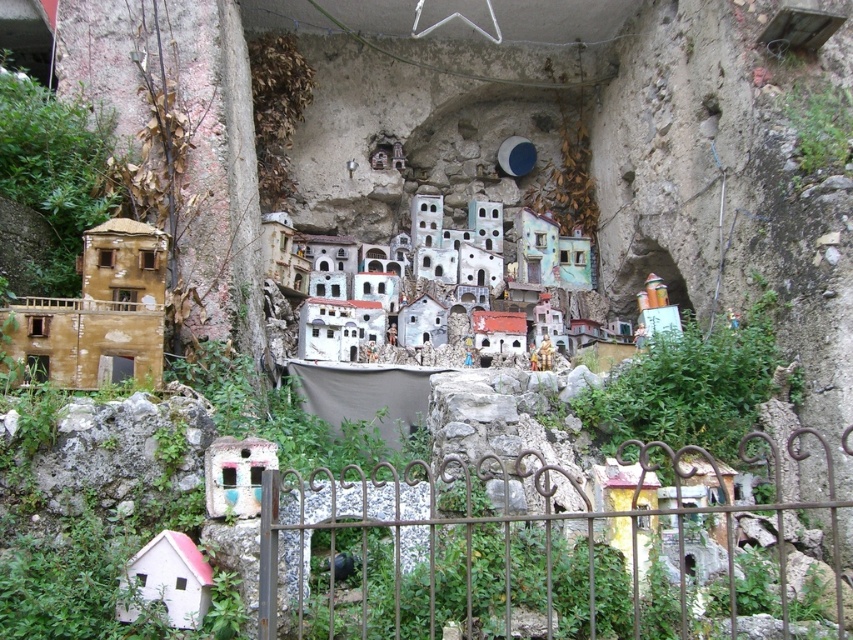
You are an artist planning to paint a miniature village scene. You have two houses in your design, the white painted clay houses at center and the white matte house at lower center. Based on the provided image, which house should you make wider to maintain the village layout?

You should make the white painted clay houses at center wider because its width surpasses the white matte house at lower center according to the description.

You are an artist examining the miniature village carved into the rocky wall. You notice the white painted clay houses at center and the white matte house at lower center. Which of these two houses is positioned to the right of the other?

The white painted clay houses at center is positioned to the right of the white matte house at lower center.